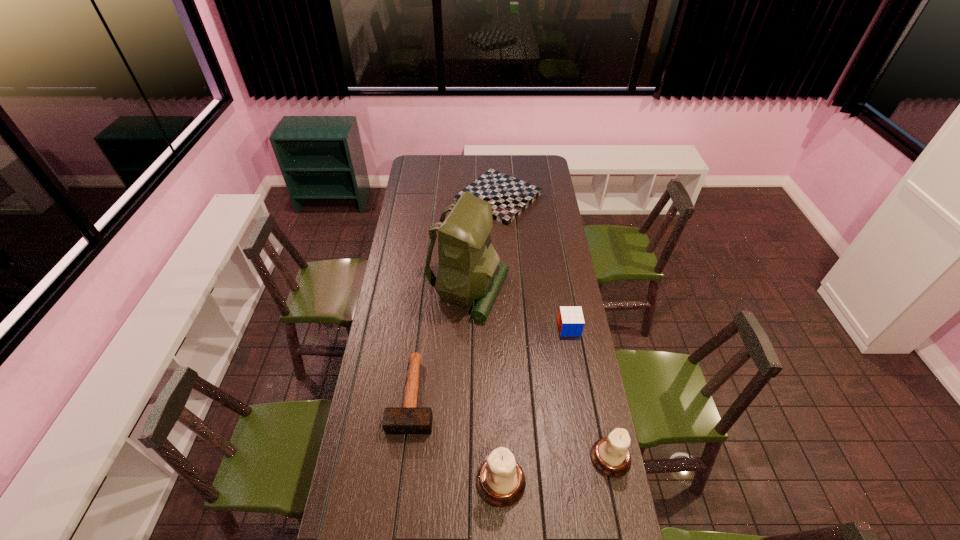
Considering the uniform spacing of candle holders, where should an additional candle holder be positioned on the left? Please locate a free spot. Please provide its 2D coordinates. Your answer should be formatted as a tuple, i.e. [(x, y)], where the tuple contains the x and y coordinates of a point satisfying the conditions above.

[(383, 508)]